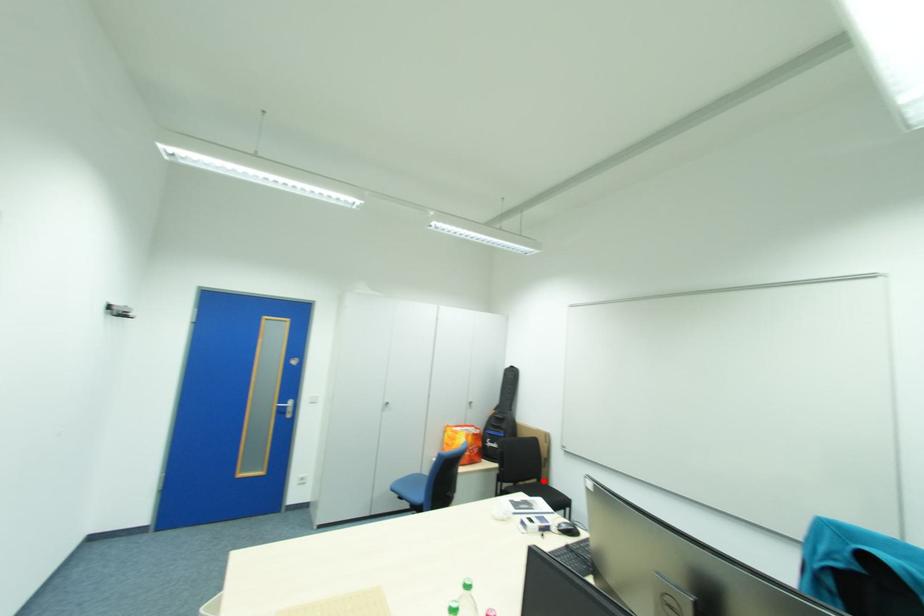
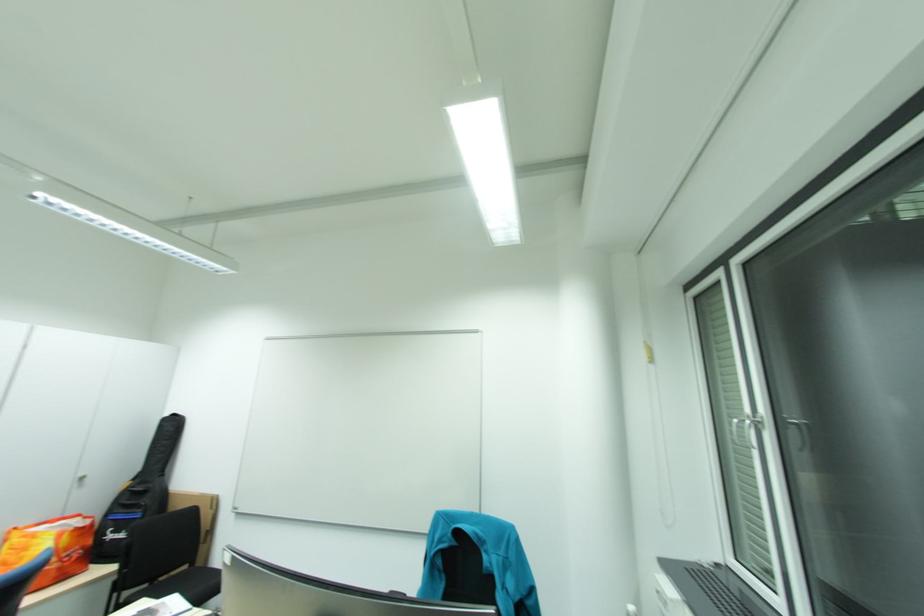
Locate, in the second image, the point that corresponds to the highlighted location in the first image.

(193, 568)